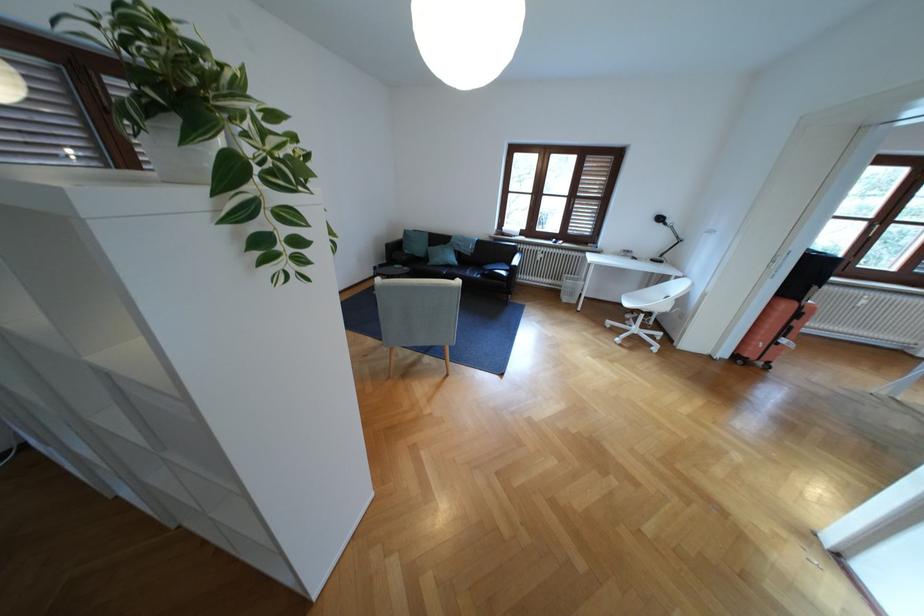
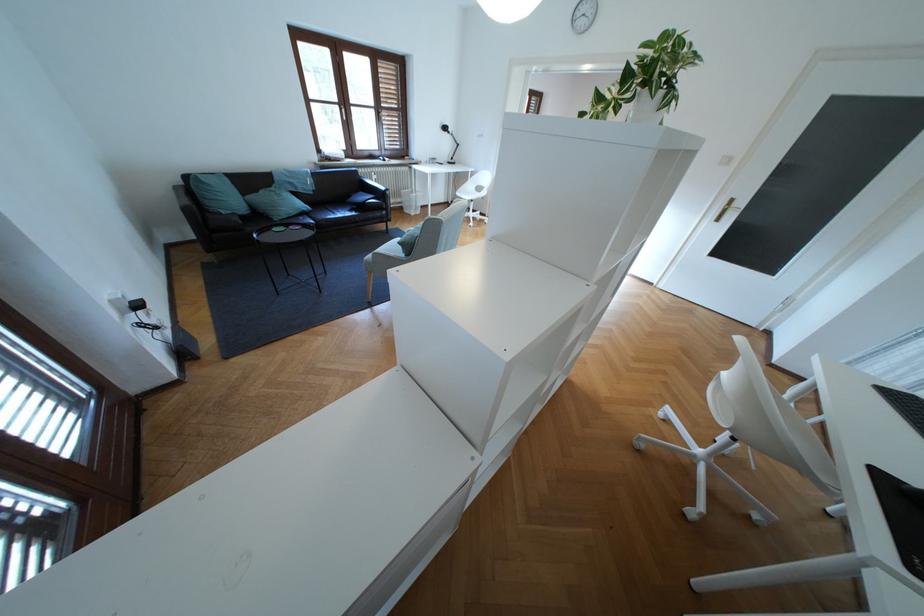
Find the pixel in the second image that matches point (572, 296) in the first image.

(417, 211)